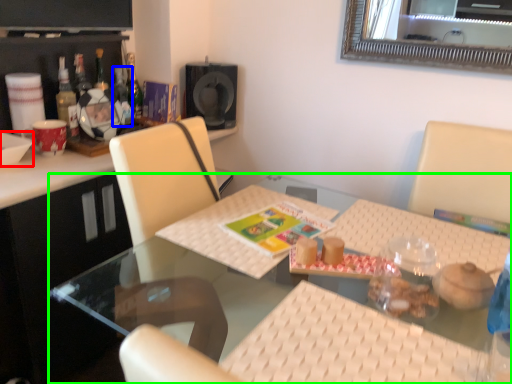
Question: Considering the real-world distances, which object is farthest from bowl (highlighted by a red box)? bottle (highlighted by a blue box) or table (highlighted by a green box)?

Choices:
 (A) bottle
 (B) table

Answer: (B)